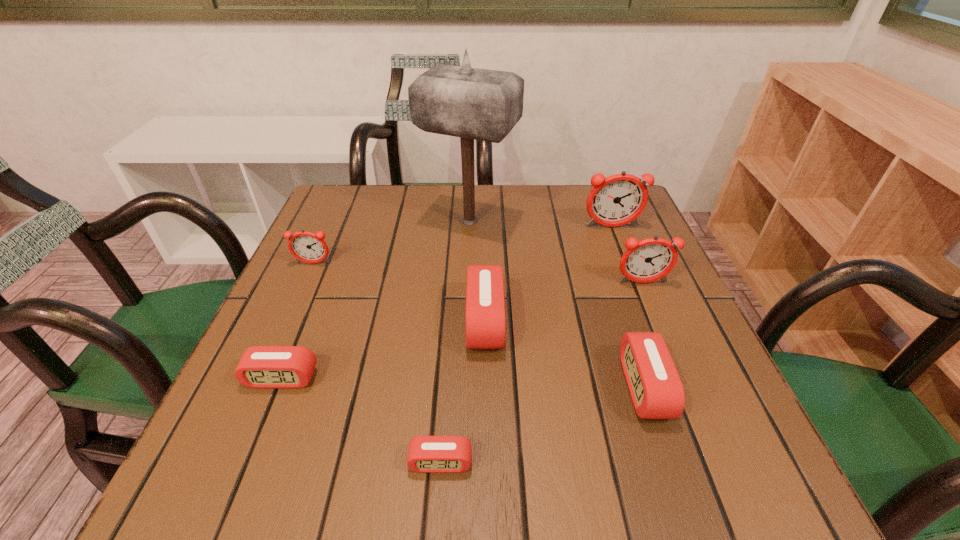
Where is `the second closest pink alarm clock to the smallest reddish-pink alarm clock`? The width and height of the screenshot is (960, 540). the second closest pink alarm clock to the smallest reddish-pink alarm clock is located at coordinates (485, 306).

Locate an element on the screen. This screenshot has height=540, width=960. pink alarm clock that can be found as the third closest to the mallet is located at coordinates pos(273,367).

Find the location of a particular element. free spot that satisfies the following two spatial constraints: 1. on the front-facing side of the third farthest alarm clock; 2. on the front-facing side of the rightmost pink alarm clock is located at coordinates (685, 387).

The width and height of the screenshot is (960, 540). What are the coordinates of `vacant region that satisfies the following two spatial constraints: 1. on the front-facing side of the farthest alarm clock; 2. on the front-facing side of the biggest pink alarm clock` in the screenshot? It's located at (649, 321).